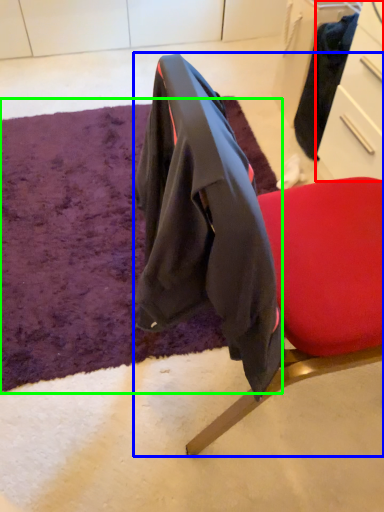
Question: Considering the real-world distances, which object is farthest from drawer (highlighted by a red box)? chair (highlighted by a blue box) or mat (highlighted by a green box)?

Choices:
 (A) chair
 (B) mat

Answer: (B)